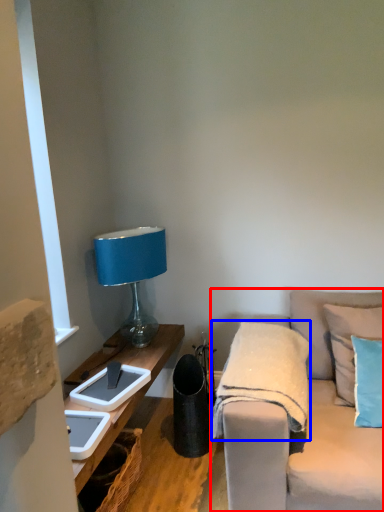
Question: Which object is closer to the camera taking this photo, studio couch (highlighted by a red box) or blanket (highlighted by a blue box)?

Choices:
 (A) studio couch
 (B) blanket

Answer: (A)